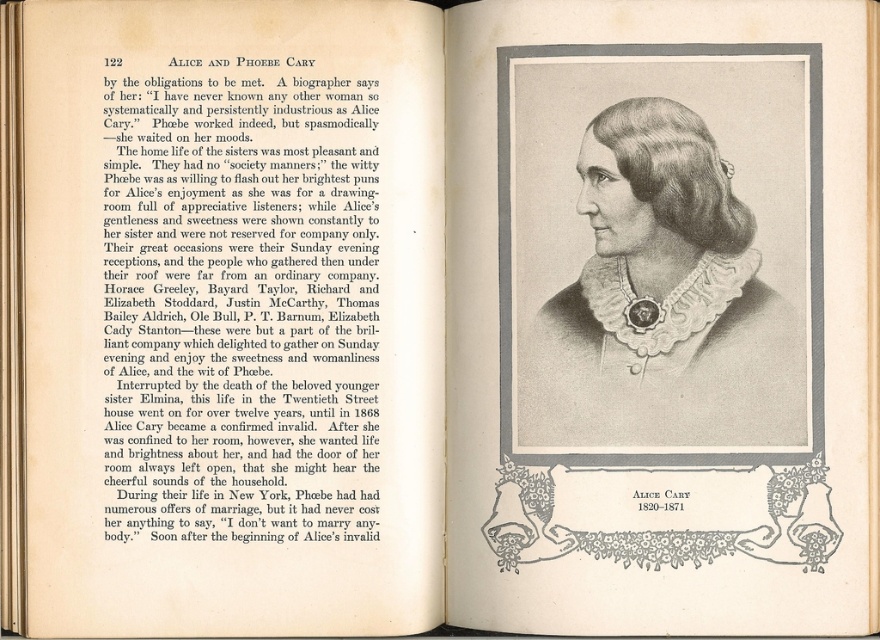
You are looking at an open book. The book has two pages. On the left page, there is black paper text at upper left. On the right page, there is a black and white portrait at center. Which object is closer to you?

The black paper text at upper left is closer to the viewer than the black and white portrait at center.

You are a book conservator examining the open book. You need to determine if the black paper text at upper left can fit into a preservation sleeve designed for items narrower than the black and white portrait at center. Can it fit?

The black paper text at upper left has a width less than the black and white portrait at center, so it can fit into the preservation sleeve designed for items narrower than the portrait.

Looking at the open book page, which object takes up more space in the image? The black paper text at upper left or the black and white portrait at center?

The black paper text at upper left has a larger size compared to the black and white portrait at center, so it takes up more space in the image.